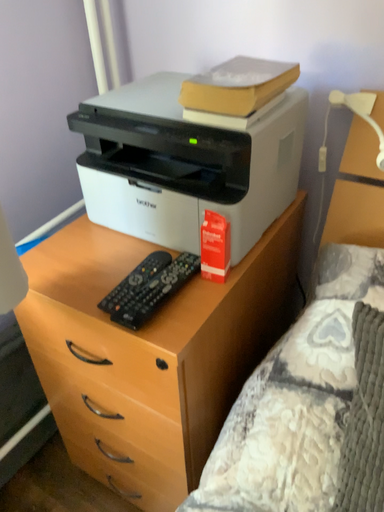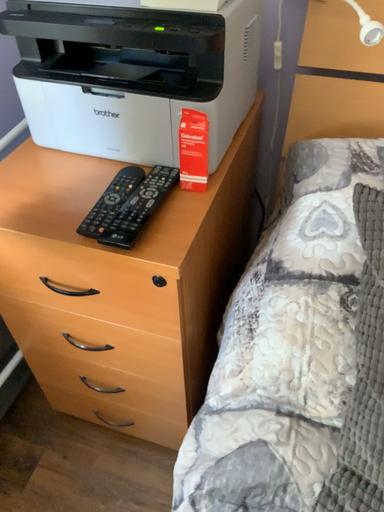
Question: How did the camera likely rotate when shooting the video?

Choices:
 (A) rotated downward
 (B) rotated upward

Answer: (A)